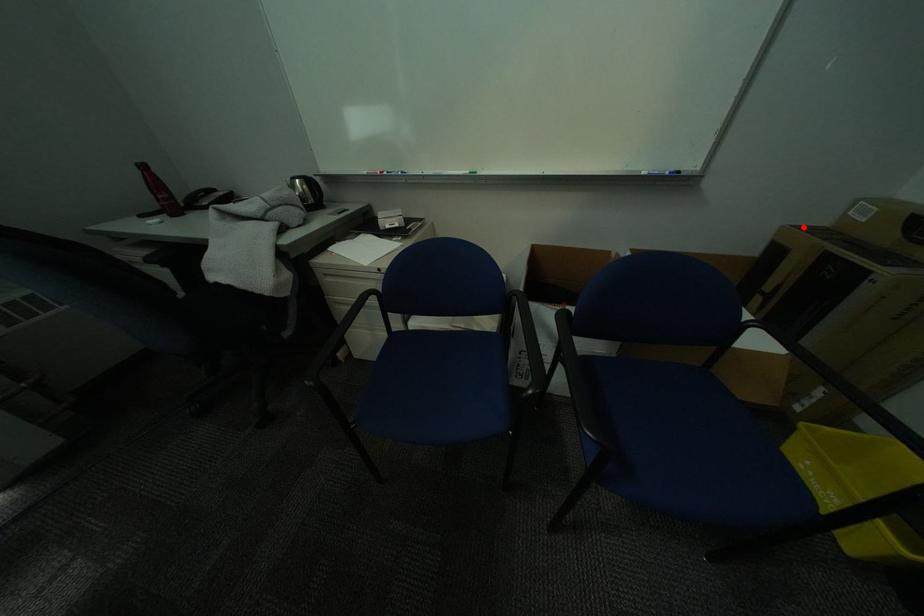
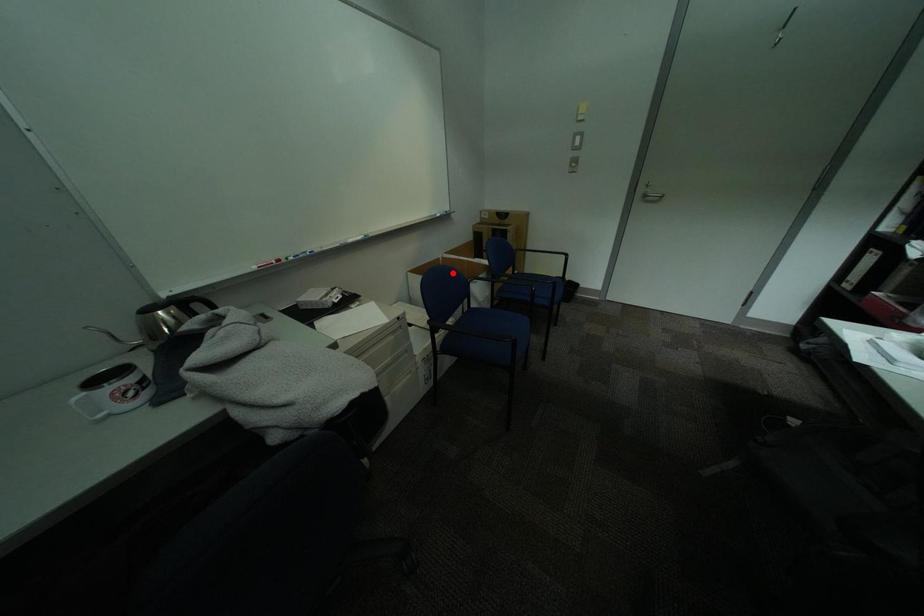
I am providing you with two images of the same scene from different viewpoints. A red point is marked on the first image and another point is marked on the second image. Do the highlighted points in image1 and image2 indicate the same real-world spot?

No